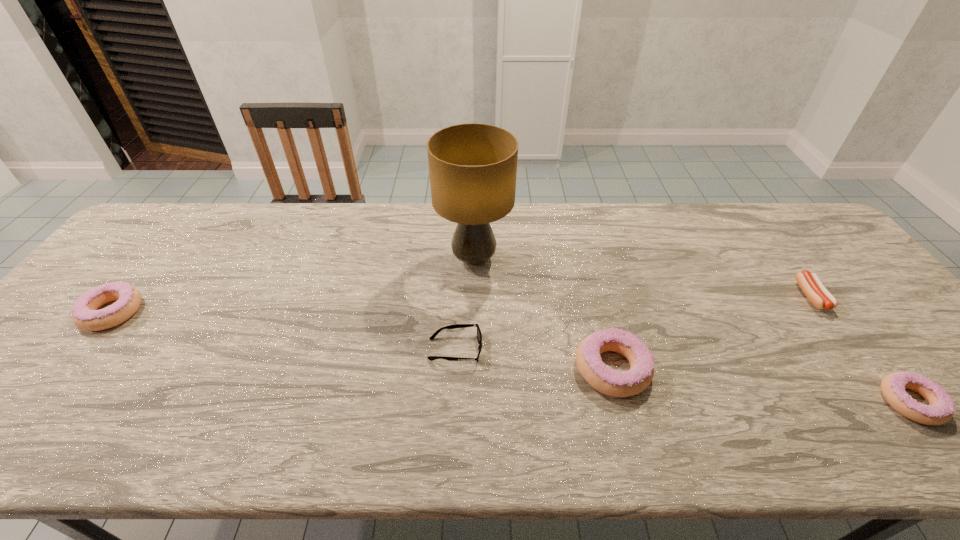
In order to click on the leftmost doughnut in this screenshot , I will do [x=85, y=315].

Find the location of a particular element. Image resolution: width=960 pixels, height=540 pixels. the second shortest doughnut is located at coordinates (85, 315).

At what (x,y) coordinates should I click in order to perform the action: click on the fourth object from left to right. Please return your answer as a coordinate pair (x, y). This screenshot has height=540, width=960. Looking at the image, I should click on (601, 377).

Where is `the second shortest object`? Image resolution: width=960 pixels, height=540 pixels. the second shortest object is located at coordinates (811, 285).

Where is `lampshade`? The width and height of the screenshot is (960, 540). lampshade is located at coordinates (473, 167).

I want to click on sunglasses, so click(479, 336).

Identify the location of vacant region located 0.180m on the right of the leftmost doughnut. (209, 312).

Where is `vacant region located 0.400m on the left of the third object from right to left`? vacant region located 0.400m on the left of the third object from right to left is located at coordinates [x=404, y=368].

Locate an element on the screen. The image size is (960, 540). free space located on the back of the fifth tallest object is located at coordinates (745, 207).

Identify the location of vacant region located on the left of the lampshade. (332, 259).